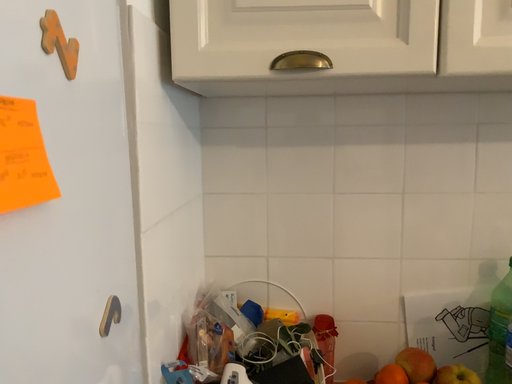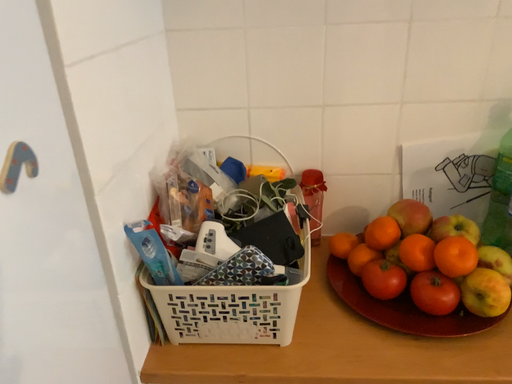
Question: Which way did the camera rotate in the video?

Choices:
 (A) rotated upward
 (B) rotated downward

Answer: (B)